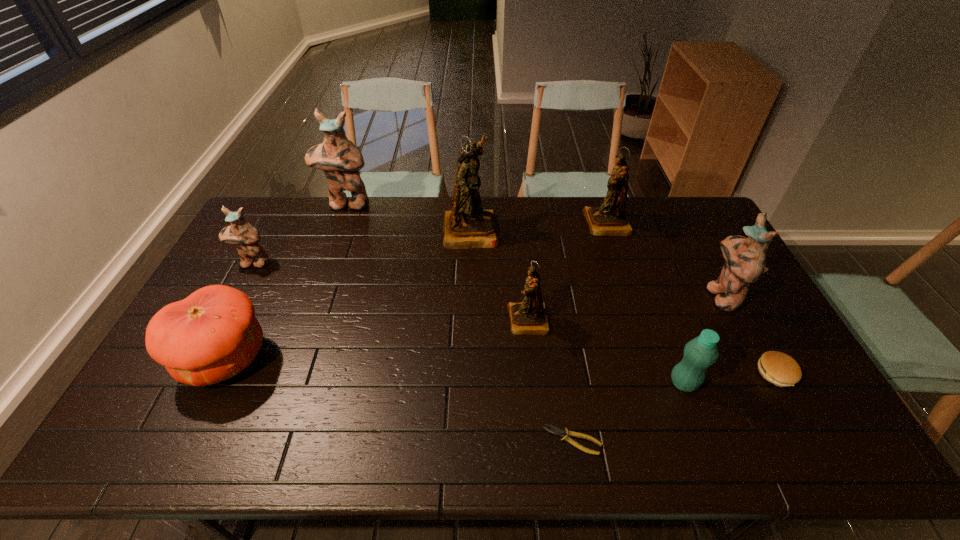
Locate an element on the screen. free spot located at the front cap of the water bottle is located at coordinates (646, 383).

Where is `vacant space located at the front cap of the water bottle`? Image resolution: width=960 pixels, height=540 pixels. vacant space located at the front cap of the water bottle is located at coordinates tap(646, 383).

Image resolution: width=960 pixels, height=540 pixels. Identify the location of vacant space located at the front cap of the water bottle. (569, 383).

You are a GUI agent. You are given a task and a screenshot of the screen. Output one action in this format:
    pyautogui.click(x=<x>, y=<y>)
    Task: Click on the free space located on the back of the second shortest object
    This screenshot has width=960, height=540.
    Given the screenshot: What is the action you would take?
    pyautogui.click(x=725, y=280)

Where is `free space located on the right of the shortest object`? This screenshot has width=960, height=540. free space located on the right of the shortest object is located at coordinates (635, 440).

Locate an element on the screen. Image resolution: width=960 pixels, height=540 pixels. object that is positioned at the near edge is located at coordinates (557, 431).

This screenshot has width=960, height=540. I want to click on figurine that is at the left edge, so (x=245, y=237).

Locate an element on the screen. pumpkin that is at the left edge is located at coordinates (212, 335).

I want to click on figurine that is at the right edge, so click(745, 258).

I want to click on patty that is at the right edge, so click(x=776, y=367).